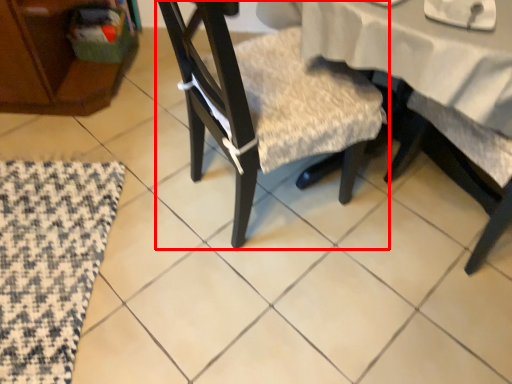
Question: From the image's perspective, where is chair (annotated by the red box) located relative to mat?

Choices:
 (A) above
 (B) below

Answer: (A)